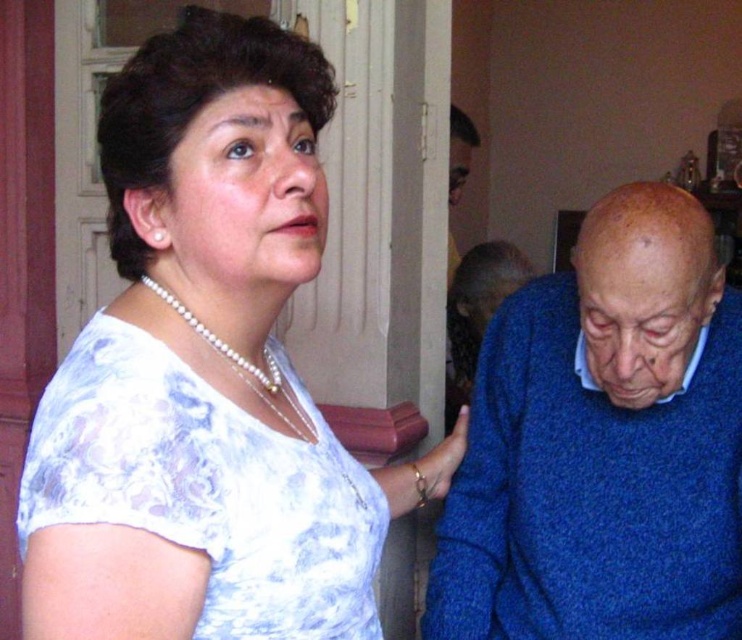
Consider the image. Is white lace blouse at upper left smaller than blue knitted sweater at right?

Correct, white lace blouse at upper left occupies less space than blue knitted sweater at right.

Which of these two, white lace blouse at upper left or blue knitted sweater at right, stands taller?

Standing taller between the two is blue knitted sweater at right.

Is point (335, 605) more distant than point (587, 388)?

No, it is in front of (587, 388).

The width and height of the screenshot is (742, 640). Find the location of `white lace blouse at upper left`. white lace blouse at upper left is located at coordinates (197, 348).

Does white lace blouse at upper left have a greater height compared to pearl necklace at upper left?

Correct, white lace blouse at upper left is much taller as pearl necklace at upper left.

Who is more forward, (160,481) or (186,317)?

Point (160,481) is more forward.

Locate an element on the screen. white lace blouse at upper left is located at coordinates (197, 348).

Can you confirm if blue knitted sweater at right is positioned above pearl necklace at upper left?

No, blue knitted sweater at right is not above pearl necklace at upper left.

Is blue knitted sweater at right further to the viewer compared to pearl necklace at upper left?

That is True.

Identify the location of blue knitted sweater at right. This screenshot has width=742, height=640. (603, 444).

What are the coordinates of `blue knitted sweater at right` in the screenshot? It's located at (603, 444).